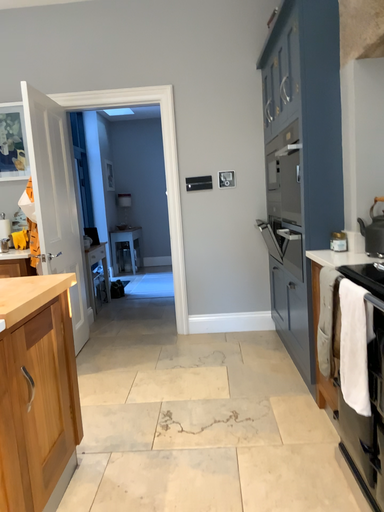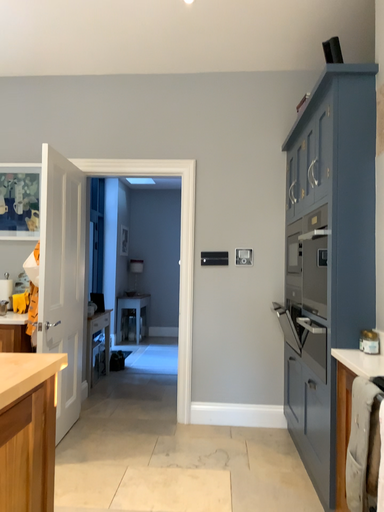
Question: How did the camera likely rotate when shooting the video?

Choices:
 (A) rotated upward
 (B) rotated downward

Answer: (A)